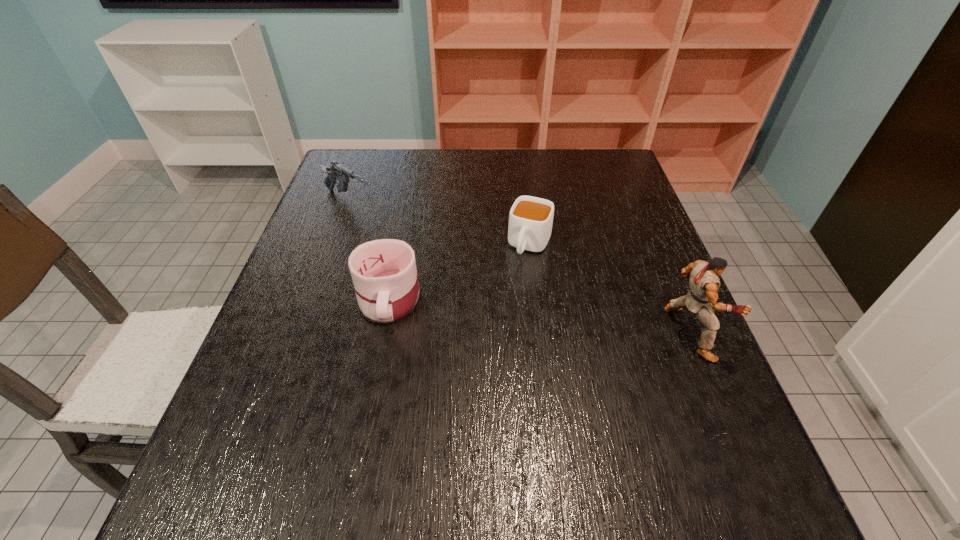
At what (x,y) coordinates should I click in order to perform the action: click on the closest object to the rightmost object. Please return your answer as a coordinate pair (x, y). The height and width of the screenshot is (540, 960). Looking at the image, I should click on (530, 220).

Find the location of a particular element. The height and width of the screenshot is (540, 960). object that stands as the third closest to the cup is located at coordinates (335, 171).

The image size is (960, 540). I want to click on free point that satisfies the following two spatial constraints: 1. on the side with the handle of the rightmost object; 2. on the front-facing side of the third object from right to left, so click(x=382, y=333).

At what (x,y) coordinates should I click in order to perform the action: click on free space that satisfies the following two spatial constraints: 1. on the side with the handle of the third object from right to left; 2. on the front-facing side of the tallest object. Please return your answer as a coordinate pair (x, y). The height and width of the screenshot is (540, 960). Looking at the image, I should click on (382, 333).

Locate an element on the screen. The height and width of the screenshot is (540, 960). vacant point that satisfies the following two spatial constraints: 1. on the side with the handle of the puncher; 2. on the front-facing side of the second object from left to right is located at coordinates (382, 333).

I want to click on free region that satisfies the following two spatial constraints: 1. on the side with the handle of the mug; 2. on the front-facing side of the puncher, so click(382, 333).

Locate an element on the screen. The image size is (960, 540). free region that satisfies the following two spatial constraints: 1. on the side with the handle of the puncher; 2. on the front-facing side of the third object from right to left is located at coordinates (382, 333).

The height and width of the screenshot is (540, 960). I want to click on vacant region that satisfies the following two spatial constraints: 1. on the side with the handle of the puncher; 2. on the front-facing side of the second object from left to right, so click(x=382, y=333).

The height and width of the screenshot is (540, 960). I want to click on free space that satisfies the following two spatial constraints: 1. on the front side of the tallest object; 2. on the front-facing side of the farthest object, so click(x=304, y=333).

In order to click on blank area in the image that satisfies the following two spatial constraints: 1. on the side with the handle of the rightmost object; 2. on the front-facing side of the third object from right to left in this screenshot , I will do `click(382, 333)`.